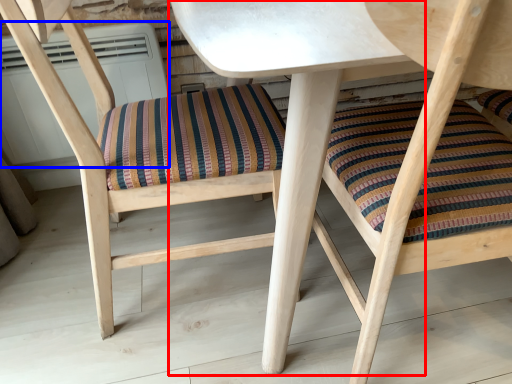
Question: Which of the following is the farthest to the observer, table (highlighted by a red box) or air conditioner (highlighted by a blue box)?

Choices:
 (A) table
 (B) air conditioner

Answer: (B)